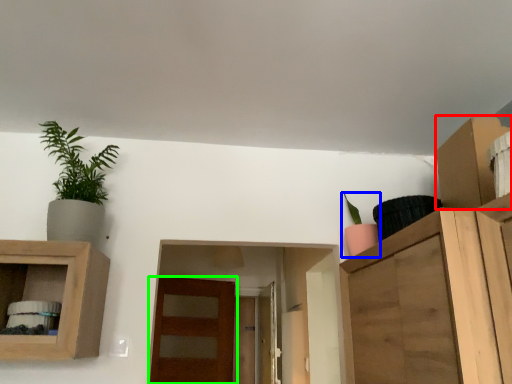
Question: Considering the real-world distances, which object is closest to cabinet (highlighted by a red box)? houseplant (highlighted by a blue box) or door (highlighted by a green box).

Choices:
 (A) houseplant
 (B) door

Answer: (A)